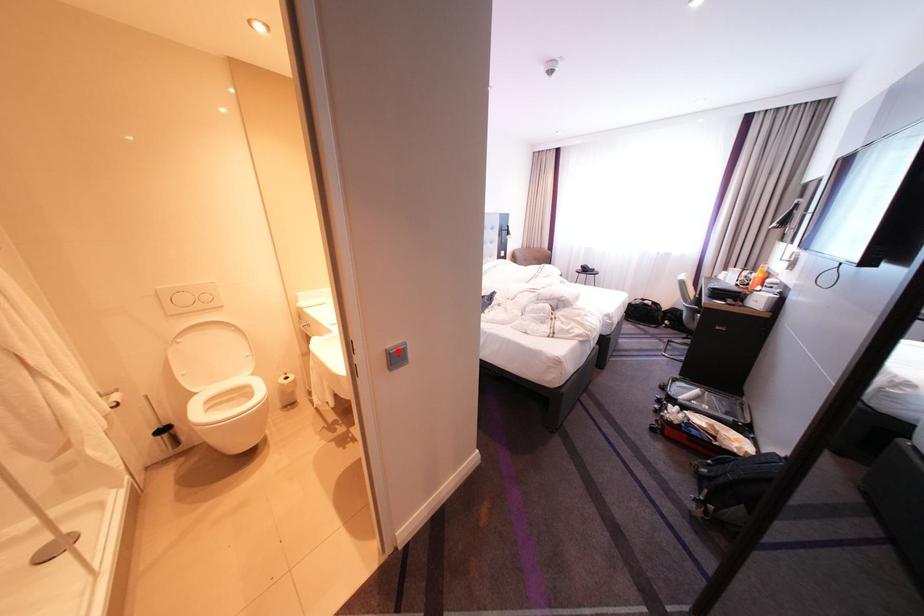
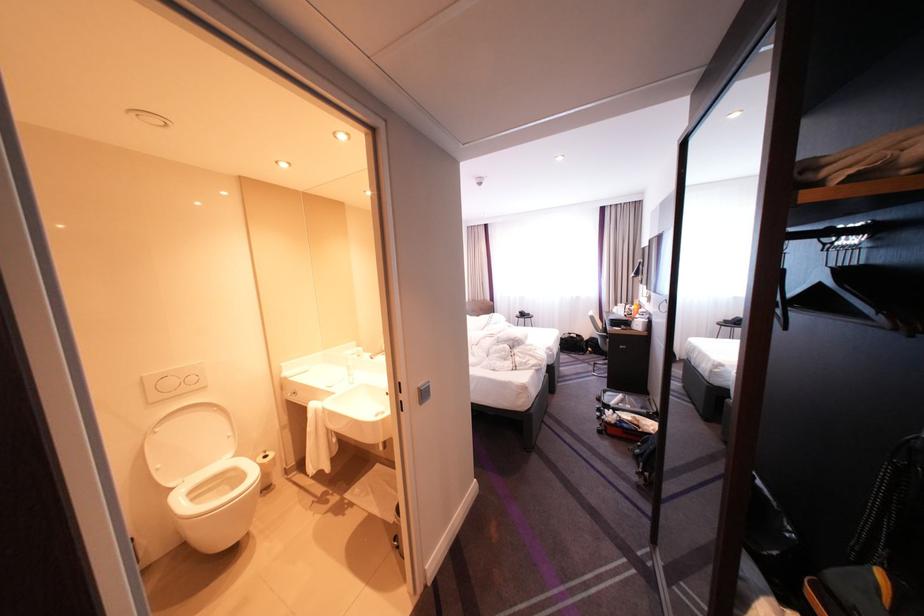
Locate, in the second image, the point that corresponds to the highlighted location in the first image.

(430, 389)